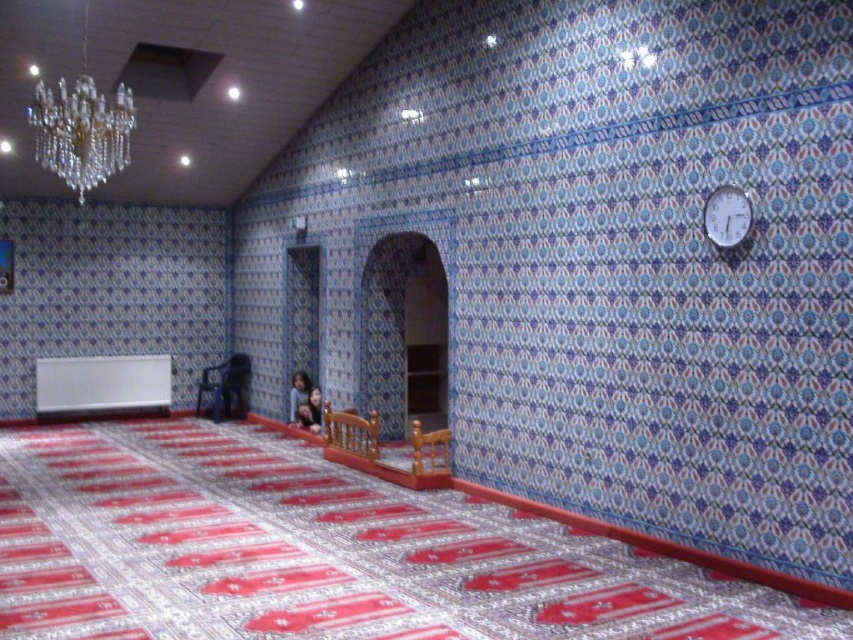
Question: Does crystal glass chandelier at upper left appear on the left side of white plastic clock at upper right?

Choices:
 (A) yes
 (B) no

Answer: (A)

Question: Among these objects, which one is nearest to the camera?

Choices:
 (A) white plastic clock at upper right
 (B) metallic blue chair at center

Answer: (A)

Question: Among these points, which one is farthest from the camera?

Choices:
 (A) (746, 216)
 (B) (234, 400)

Answer: (B)

Question: Is crystal glass chandelier at upper left positioned before metallic blue chair at center?

Choices:
 (A) no
 (B) yes

Answer: (B)

Question: Among these points, which one is farthest from the camera?

Choices:
 (A) (115, 161)
 (B) (241, 390)
 (C) (727, 234)

Answer: (B)

Question: Can you confirm if crystal glass chandelier at upper left is positioned below metallic blue chair at center?

Choices:
 (A) no
 (B) yes

Answer: (A)